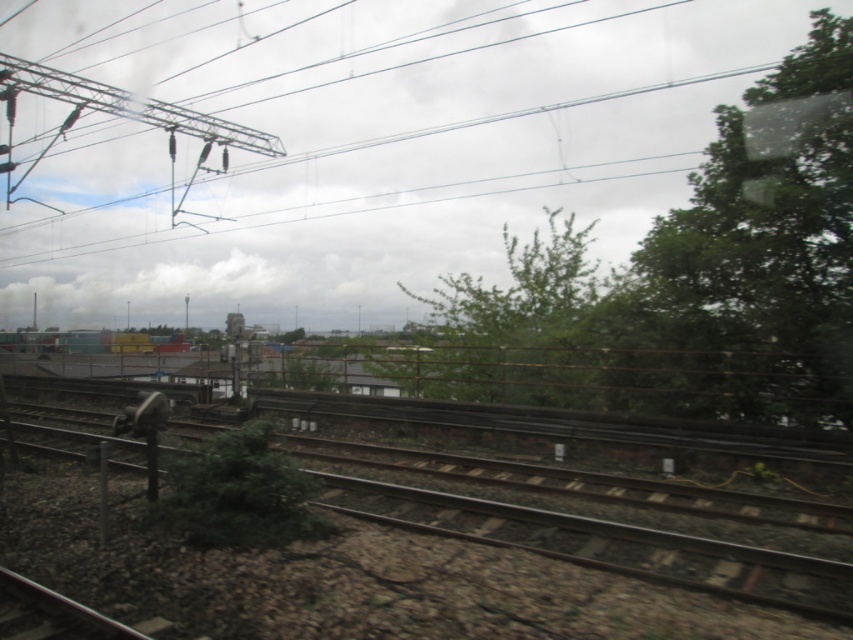
You are standing on the train tracks and see two points marked on the ground. The first point is at coordinates point (x=811, y=403) and the second point is at point (x=122, y=332). Which point is closer to you?

Point (x=811, y=403) is closer to the viewer than point (x=122, y=332).

You are a drone operator trying to fly a drone between the metallic wire at upper center and the green leafy tree at center. The drone has a wingspan of 1.5 meters. Can the drone safely pass through the space between them without touching either?

The metallic wire at upper center and the green leafy tree at center are 14.48 meters apart from each other. Since the drone has a wingspan of 1.5 meters, which is much smaller than the 14.48 meters distance between them, the drone can safely pass through the space without touching either.

You are a passenger on the train and looking out the window. You see a point marked at coordinate (694,278). What object is located at that point?

The point at coordinate (694,278) indicates a green leafy tree at center.